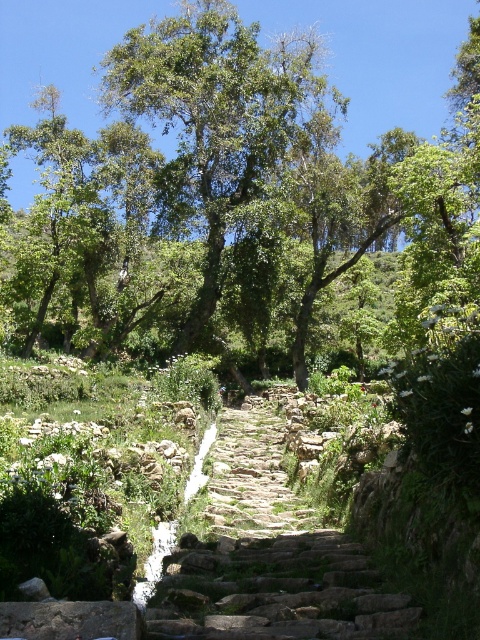
Can you confirm if green leafy tree at upper center is taller than rusty stone stairs at center?

Correct, green leafy tree at upper center is much taller as rusty stone stairs at center.

Is green leafy tree at upper center bigger than rusty stone stairs at center?

Indeed, green leafy tree at upper center has a larger size compared to rusty stone stairs at center.

Find the location of a particular element. green leafy tree at upper center is located at coordinates (215, 118).

Which is above, green leafy tree at center or green leafy tree at upper center?

green leafy tree at center is above.

Which of these two, green leafy tree at center or green leafy tree at upper center, stands taller?

green leafy tree at upper center is taller.

I want to click on green leafy tree at center, so click(x=377, y=54).

At what (x,y) coordinates should I click in order to perform the action: click on green leafy tree at center. Please return your answer as a coordinate pair (x, y). This screenshot has width=480, height=640. Looking at the image, I should click on (377, 54).

Can you confirm if green leafy tree at center is wider than rusty stone stairs at center?

Indeed, green leafy tree at center has a greater width compared to rusty stone stairs at center.

Which is below, green leafy tree at center or rusty stone stairs at center?

Positioned lower is rusty stone stairs at center.

Find the location of a particular element. Image resolution: width=480 pixels, height=640 pixels. green leafy tree at center is located at coordinates (377, 54).